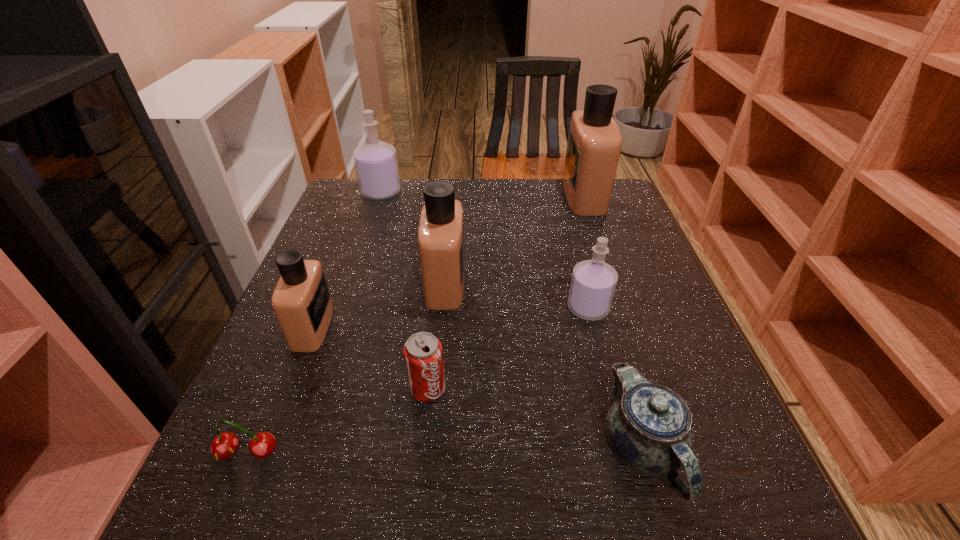
Image resolution: width=960 pixels, height=540 pixels. What are the coordinates of `free location located 0.190m on the front of the pink soda can` in the screenshot? It's located at (414, 524).

Find the location of a particular element. vacant region located 0.070m with stems pointing upwards on the shortest object is located at coordinates (222, 515).

Locate an element on the screen. The width and height of the screenshot is (960, 540). object that is at the near edge is located at coordinates (648, 427).

I want to click on cherry that is at the left edge, so click(224, 445).

Locate an element on the screen. The width and height of the screenshot is (960, 540). chinaware present at the right edge is located at coordinates (648, 427).

Find the location of a particular element. This screenshot has width=960, height=540. object that is at the far left corner is located at coordinates (376, 165).

This screenshot has width=960, height=540. Identify the location of object present at the far right corner. (x=594, y=144).

In order to click on object present at the near right corner in this screenshot , I will do `click(648, 427)`.

Find the location of a particular element. free region at the far edge of the desktop is located at coordinates (538, 197).

Find the location of a particular element. free location at the left edge of the desktop is located at coordinates (359, 287).